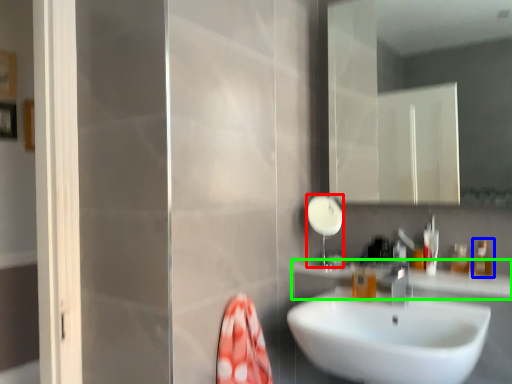
Question: Considering the real-world distances, which object is closest to shower (highlighted by a red box)? toiletry (highlighted by a blue box) or counter top (highlighted by a green box).

Choices:
 (A) toiletry
 (B) counter top

Answer: (B)